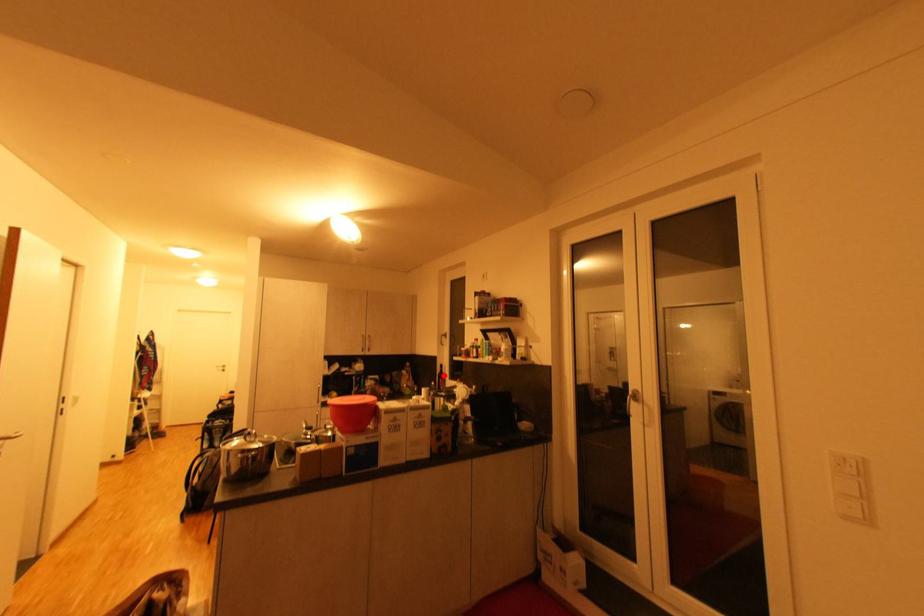
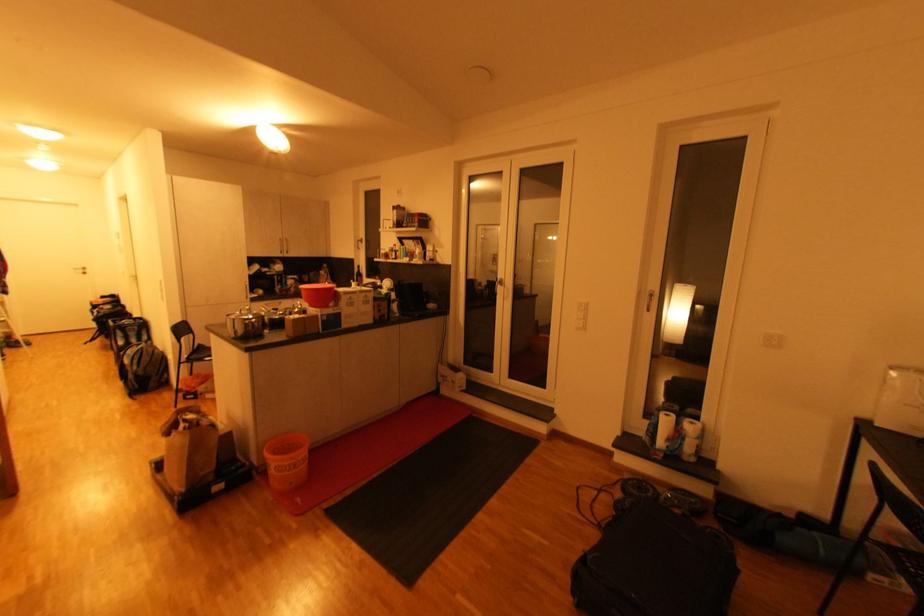
Question: I am providing you with two images of the same scene from different viewpoints. Given a red point in image1, look at the same physical point in image2. Is it:

Choices:
 (A) Closer to the viewpoint
 (B) Farther from the viewpoint

Answer: (A)